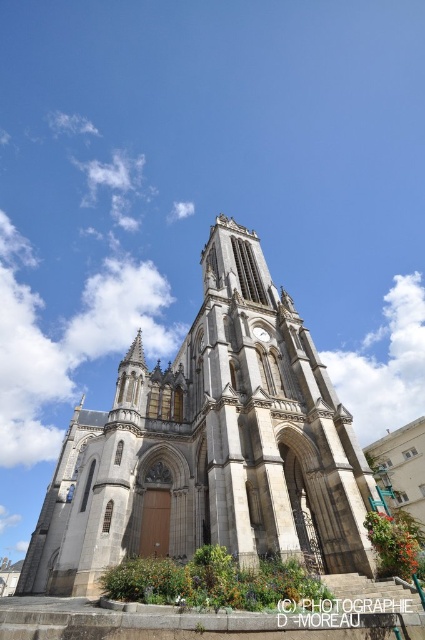
You are standing at the base of the Gothic church and notice two points marked on the tower. The first point is at coordinates point (x=248, y=465) and the second at point (x=268, y=333). From your vantage point, which point appears closer to you?

Point (x=248, y=465) is in front of point (x=268, y=333), so it appears closer to you.

You are standing in front of the light gray stone church at center and want to look up at the white stone clock at center. Since the church is tall, will you need to tilt your head upwards to see the clock?

The light gray stone church at center is positioned under the white stone clock at center, so yes, you will need to tilt your head upwards to see the clock because it is located above the church.

Based on the photo, you are a photographer planning to capture the grand Gothic church and its clock in a single shot. Given that your camera frame can only accommodate objects up to the width of the white stone clock at center, will the light gray stone church at center fit entirely within the frame?

The light gray stone church at center is wider than the white stone clock at center, so it will not fit entirely within the camera frame designed for the clock.